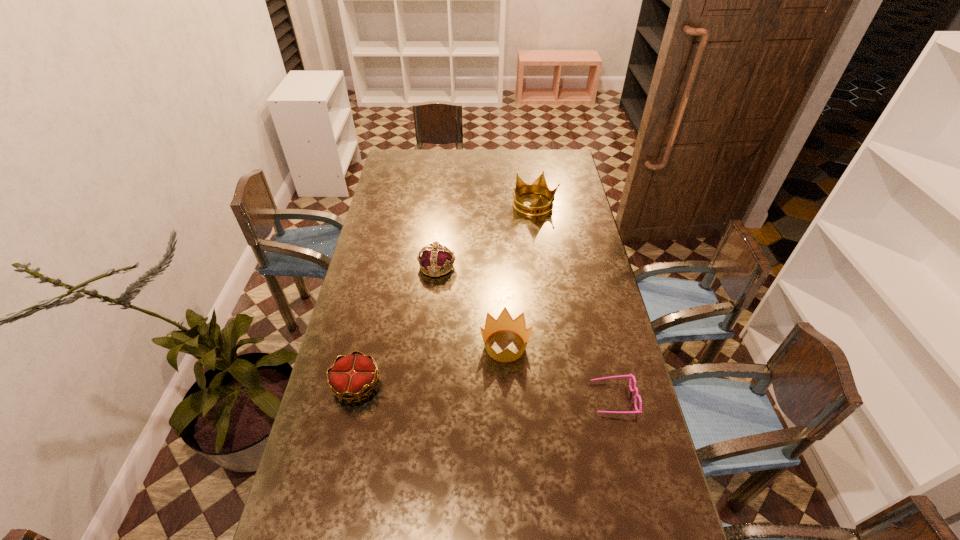
Identify the location of the farthest object. This screenshot has height=540, width=960. (539, 186).

Where is `the fourth object from right to left`? the fourth object from right to left is located at coordinates (435, 257).

Locate an element on the screen. The height and width of the screenshot is (540, 960). the second farthest crown is located at coordinates (435, 257).

Image resolution: width=960 pixels, height=540 pixels. In order to click on the fourth tallest object in this screenshot , I will do `click(351, 376)`.

Locate an element on the screen. The image size is (960, 540). the leftmost object is located at coordinates (351, 376).

Locate an element on the screen. The image size is (960, 540). spectacles is located at coordinates (637, 411).

Where is `free space located 0.380m on the back of the farthest object`? free space located 0.380m on the back of the farthest object is located at coordinates (526, 151).

Find the location of `blank space located on the front of the fourth nearest object`. blank space located on the front of the fourth nearest object is located at coordinates click(433, 305).

Where is `vacant space located 0.110m on the back of the fourth tallest object`? vacant space located 0.110m on the back of the fourth tallest object is located at coordinates (368, 336).

This screenshot has width=960, height=540. Find the location of `free spot located 0.070m on the arms of the spectacles`. free spot located 0.070m on the arms of the spectacles is located at coordinates (569, 398).